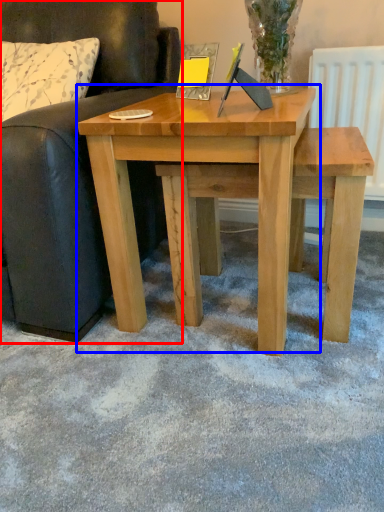
Question: Which point is further to the camera, studio couch (highlighted by a red box) or table (highlighted by a blue box)?

Choices:
 (A) studio couch
 (B) table

Answer: (B)